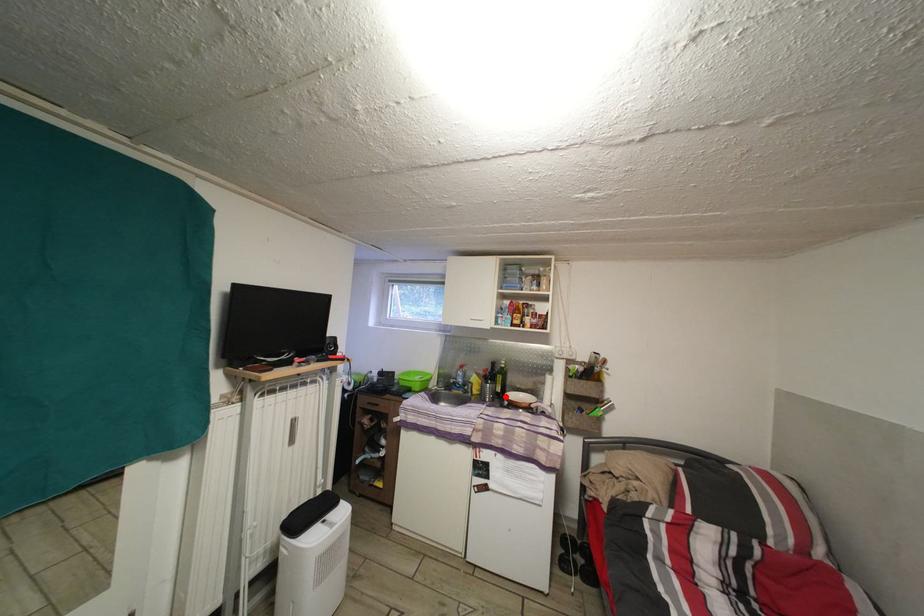
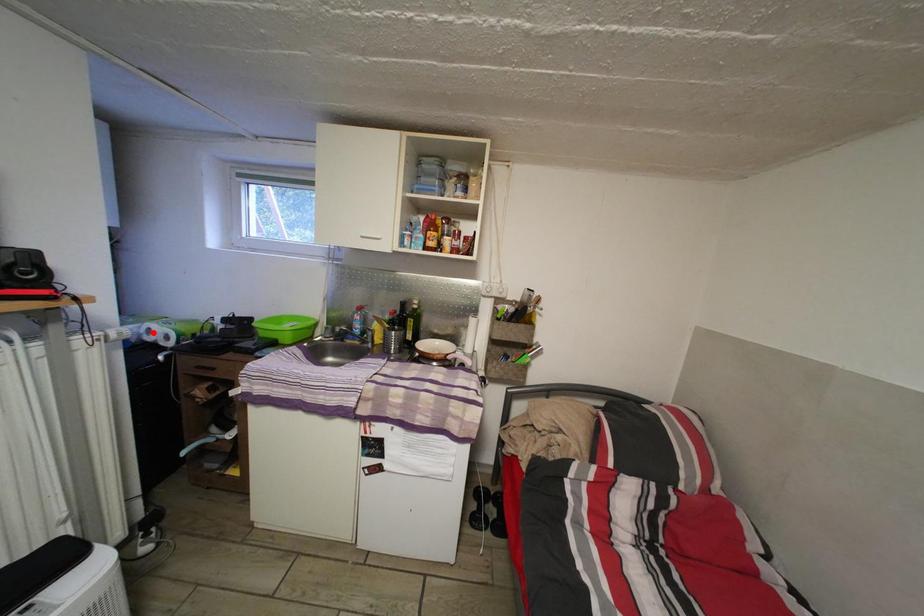
I am providing you with two images of the same scene from different viewpoints. A red point is marked on the first image and another point is marked on the second image. Does the point marked in image1 correspond to the same location as the one in image2?

No